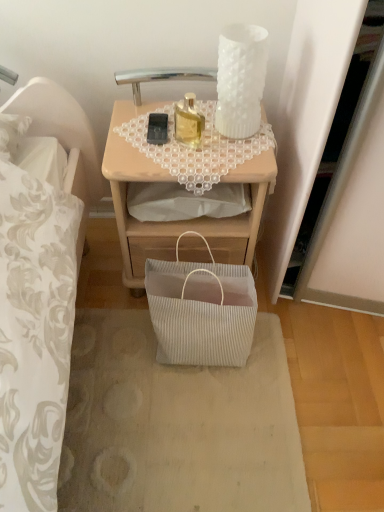
At what (x,y) coordinates should I click in order to perform the action: click on free space to the right of black matte mobile phone at upper center. Please return your answer as a coordinate pair (x, y). Looking at the image, I should click on (218, 137).